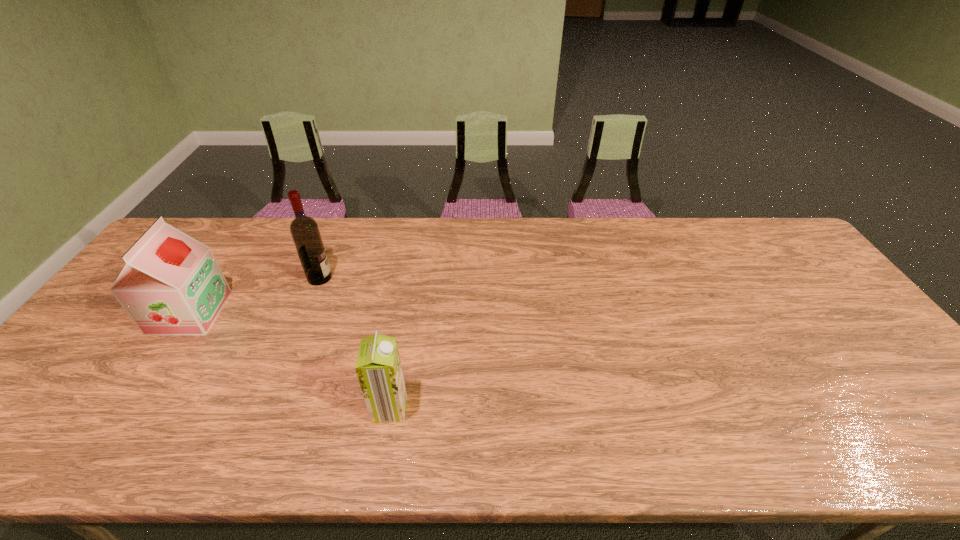
Identify the location of the second object from right to left. The image size is (960, 540). click(x=304, y=230).

Where is `alcohol`? This screenshot has width=960, height=540. alcohol is located at coordinates (304, 230).

You are a GUI agent. You are given a task and a screenshot of the screen. Output one action in this format:
    pyautogui.click(x=<x>, y=<y>)
    Task: Click on the farther soya milk
    This screenshot has height=540, width=960.
    Given the screenshot: What is the action you would take?
    pyautogui.click(x=171, y=284)

The height and width of the screenshot is (540, 960). I want to click on the taller soya milk, so click(x=171, y=284).

The image size is (960, 540). I want to click on the shortest object, so click(x=378, y=366).

Locate an element on the screen. This screenshot has width=960, height=540. the nearest object is located at coordinates (378, 366).

This screenshot has height=540, width=960. What are the coordinates of `vacant region located on the front and back of the second object from right to left` in the screenshot? It's located at (463, 278).

Locate an element on the screen. This screenshot has width=960, height=540. vacant space situated with the cap open on the second nearest object is located at coordinates (305, 313).

The height and width of the screenshot is (540, 960). I want to click on vacant position located on the back of the rightmost object, so click(395, 376).

Locate an element on the screen. The image size is (960, 540). object that is at the near edge is located at coordinates (378, 366).